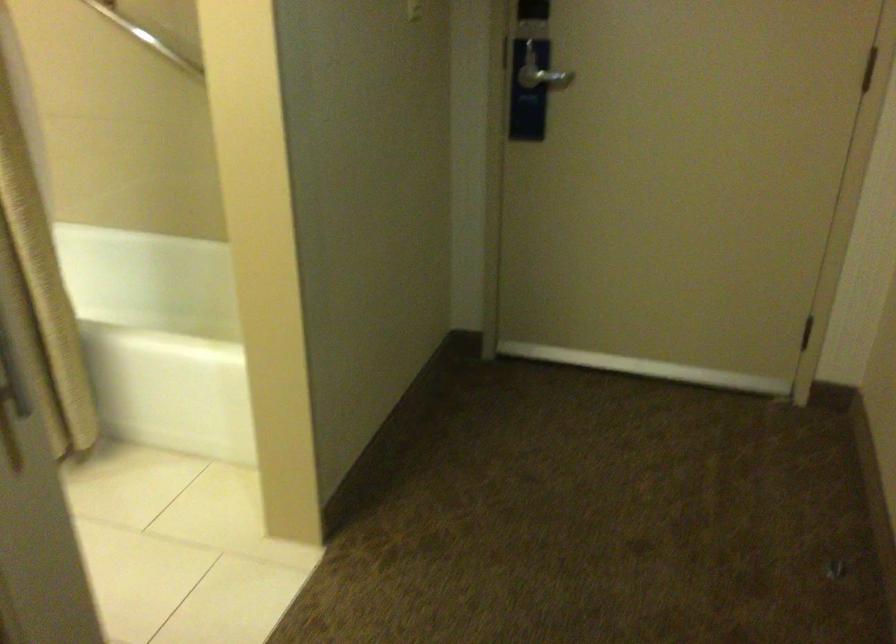
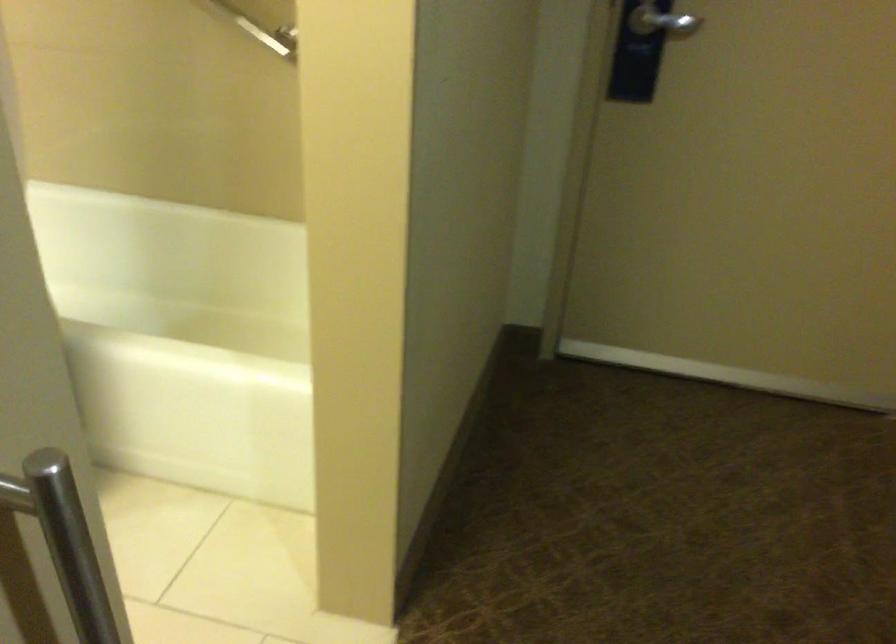
Which direction would the cameraman need to move to produce the second image?

The cameraman walked toward left, forward.